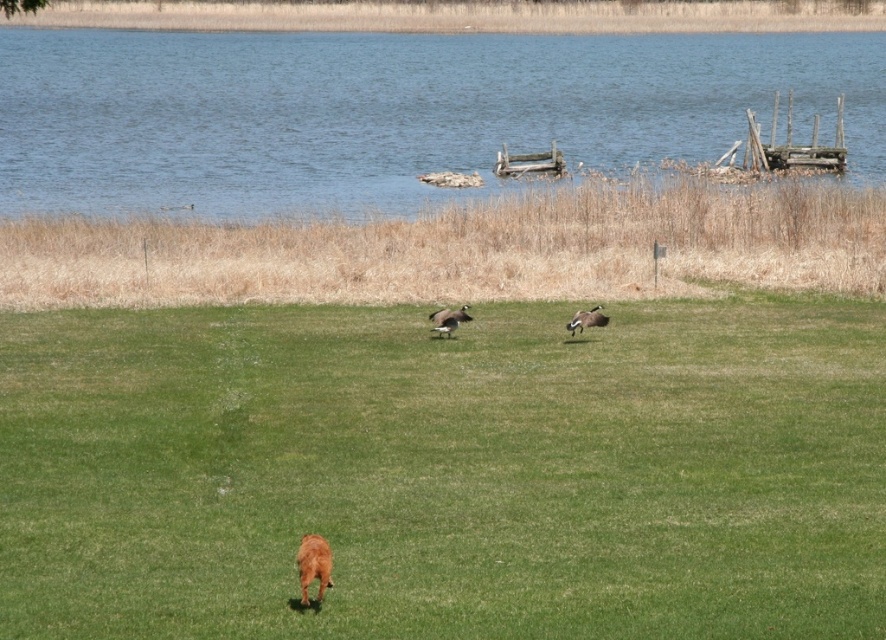
You are a photographer trying to capture both the brown furry dog at lower center and the brown matte duck at center in a single shot. Given that the camera can only focus on objects within a 3 meter range, will both subjects be in focus?

The brown furry dog at lower center is closer to the viewer than the brown matte duck at center. Since the camera can only focus on objects within a 3 meter range, both subjects will be in focus if their distance apart is within 3 meters. However, without knowing the exact distance between them, it is impossible to determine for sure.

You are a photographer trying to capture both the brown furry dog at lower center and the brown glossy duck at center in the same frame. Which animal should you focus on first if you want to ensure both are in focus?

You should focus on the brown furry dog at lower center first because it is larger and closer to the camera compared to the brown glossy duck at center, making it easier to achieve focus on both subjects.

You are a photographer standing at the edge of the field. You want to take a photo that includes both the brown furry dog at lower center and the brown glossy duck at center. What is the minimum distance you need to move forward to ensure both subjects are in frame?

The minimum distance you need to move forward is 40.84 feet to ensure both the brown furry dog at lower center and the brown glossy duck at center are in frame.